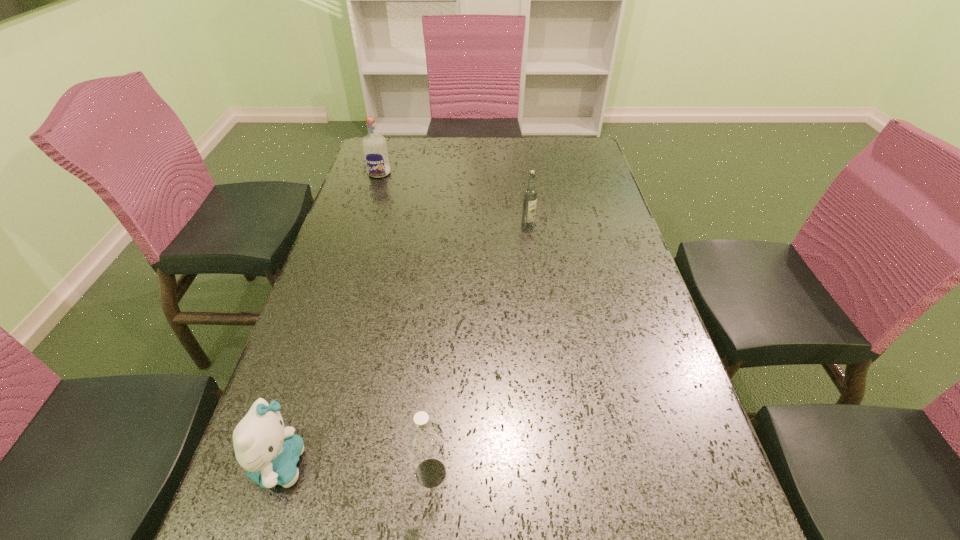
Identify the location of free space between the second farthest object and the second object from right to left. Image resolution: width=960 pixels, height=540 pixels. (479, 349).

At what (x,y) coordinates should I click in order to perform the action: click on free space between the nearest vodka and the second farthest vodka. Please return your answer as a coordinate pair (x, y). The width and height of the screenshot is (960, 540). Looking at the image, I should click on (479, 349).

Locate an element on the screen. blank region between the farthest object and the nearest vodka is located at coordinates (405, 323).

Locate an element on the screen. The width and height of the screenshot is (960, 540). empty location between the farthest vodka and the second farthest object is located at coordinates (453, 199).

The width and height of the screenshot is (960, 540). What are the coordinates of `unoccupied area between the leftmost vodka and the kitten` in the screenshot? It's located at (329, 319).

At what (x,y) coordinates should I click in order to perform the action: click on vacant area that lies between the rightmost vodka and the kitten. Please return your answer as a coordinate pair (x, y). This screenshot has width=960, height=540. Looking at the image, I should click on tap(404, 345).

Find the location of a particular element. unoccupied area between the second nearest vodka and the leftmost vodka is located at coordinates click(453, 199).

The height and width of the screenshot is (540, 960). I want to click on empty space that is in between the second farthest object and the second vodka from right to left, so click(479, 349).

At what (x,y) coordinates should I click in order to perform the action: click on vacant area between the rightmost vodka and the kitten. Please return your answer as a coordinate pair (x, y). The width and height of the screenshot is (960, 540). Looking at the image, I should click on (404, 345).

This screenshot has height=540, width=960. What are the coordinates of `free space that is in between the farthest object and the rightmost vodka` in the screenshot? It's located at (453, 199).